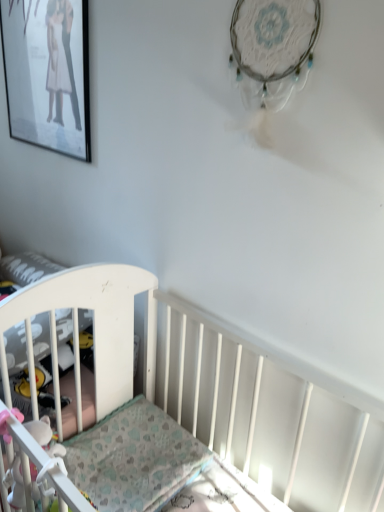
Question: Should I look upward or downward to see white fabric toy at lower left?

Choices:
 (A) down
 (B) up

Answer: (A)

Question: Does patterned fabric mattress at lower left have a lesser height compared to matte black picture frame at upper left?

Choices:
 (A) yes
 (B) no

Answer: (A)

Question: From a real-world perspective, does patterned fabric mattress at lower left sit lower than matte black picture frame at upper left?

Choices:
 (A) no
 (B) yes

Answer: (B)

Question: Is patterned fabric mattress at lower left oriented away from matte black picture frame at upper left?

Choices:
 (A) yes
 (B) no

Answer: (B)

Question: Does patterned fabric mattress at lower left have a smaller size compared to matte black picture frame at upper left?

Choices:
 (A) no
 (B) yes

Answer: (A)

Question: Can you confirm if patterned fabric mattress at lower left is bigger than matte black picture frame at upper left?

Choices:
 (A) no
 (B) yes

Answer: (B)

Question: Does patterned fabric mattress at lower left have a lesser width compared to matte black picture frame at upper left?

Choices:
 (A) no
 (B) yes

Answer: (A)

Question: Considering the relative sizes of matte black picture frame at upper left and patterned fabric mattress at lower left in the image provided, is matte black picture frame at upper left shorter than patterned fabric mattress at lower left?

Choices:
 (A) yes
 (B) no

Answer: (B)

Question: Is matte black picture frame at upper left positioned behind patterned fabric mattress at lower left?

Choices:
 (A) no
 (B) yes

Answer: (B)

Question: Could you tell me if matte black picture frame at upper left is facing patterned fabric mattress at lower left?

Choices:
 (A) yes
 (B) no

Answer: (B)

Question: Is matte black picture frame at upper left smaller than patterned fabric mattress at lower left?

Choices:
 (A) yes
 (B) no

Answer: (A)

Question: Does matte black picture frame at upper left contain patterned fabric mattress at lower left?

Choices:
 (A) no
 (B) yes

Answer: (A)

Question: Is matte black picture frame at upper left wider than patterned fabric mattress at lower left?

Choices:
 (A) no
 (B) yes

Answer: (A)

Question: Does white plastic crib at left appear on the right side of white fabric toy at lower left?

Choices:
 (A) no
 (B) yes

Answer: (A)